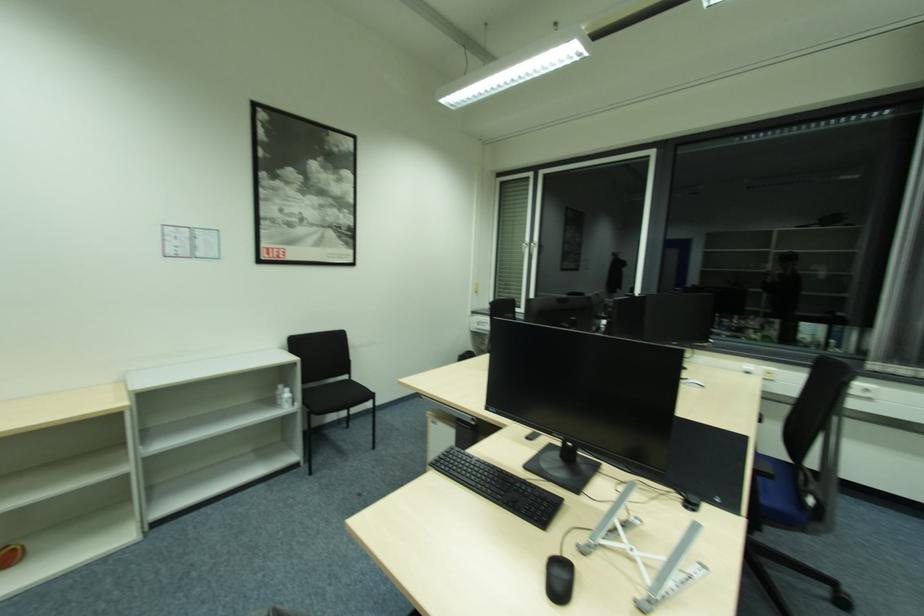
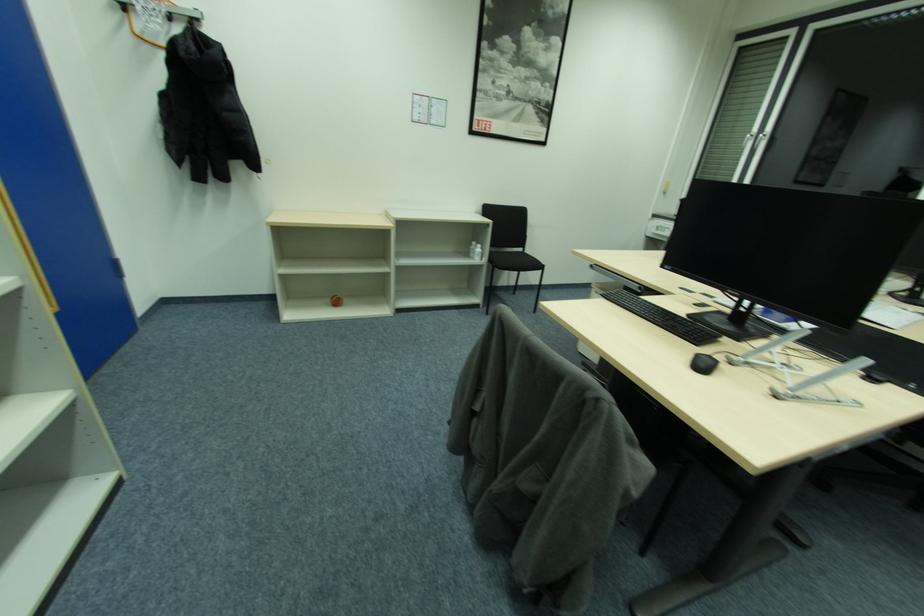
The images are taken continuously from a first-person perspective. In which direction is your viewpoint rotating?

The camera's rotation is toward left-down.